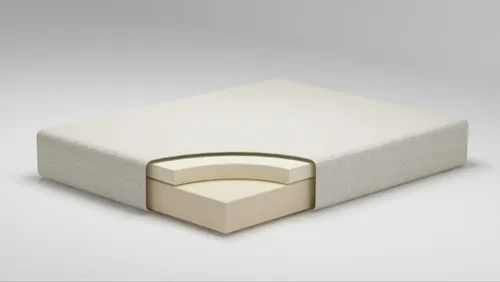
Locate an element on the screen. The width and height of the screenshot is (500, 282). woodwork is located at coordinates (105, 172).